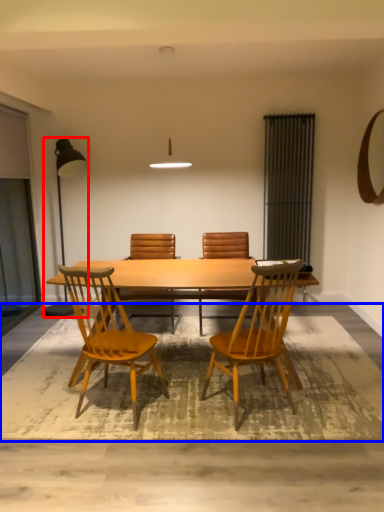
Question: Among these objects, which one is farthest to the camera, lamp (highlighted by a red box) or mat (highlighted by a blue box)?

Choices:
 (A) lamp
 (B) mat

Answer: (A)